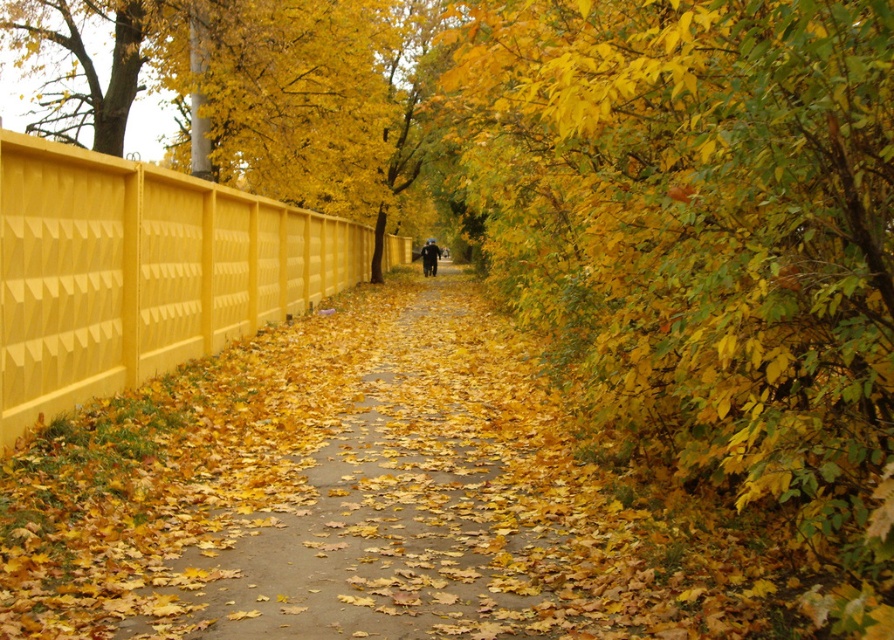
Is point (208, 634) positioned in front of point (81, 369)?

Yes.

Does yellow concrete pavement at center come behind matte yellow fence at left?

No.

Which is behind, point (512, 346) or point (179, 196)?

The point (512, 346) is more distant.

You are a GUI agent. You are given a task and a screenshot of the screen. Output one action in this format:
    pyautogui.click(x=<x>, y=<y>)
    Task: Click on the yellow concrete pavement at center
    
    Given the screenshot: What is the action you would take?
    pyautogui.click(x=419, y=509)

Who is positioned more to the left, yellow concrete pavement at center or dark blue jacket at center?

Positioned to the left is dark blue jacket at center.

Is yellow concrete pavement at center bigger than dark blue jacket at center?

Indeed, yellow concrete pavement at center has a larger size compared to dark blue jacket at center.

Looking at this image, who is more distant from viewer, (473, 332) or (422, 256)?

The point (422, 256) is behind.

I want to click on yellow concrete pavement at center, so tap(419, 509).

Who is taller, matte yellow fence at left or dark blue jacket at center?

matte yellow fence at left

Can you confirm if matte yellow fence at left is thinner than dark blue jacket at center?

Correct, matte yellow fence at left's width is less than dark blue jacket at center's.

Who is more forward, (162, 264) or (431, 259)?

Point (162, 264) is more forward.

I want to click on matte yellow fence at left, so tap(141, 272).